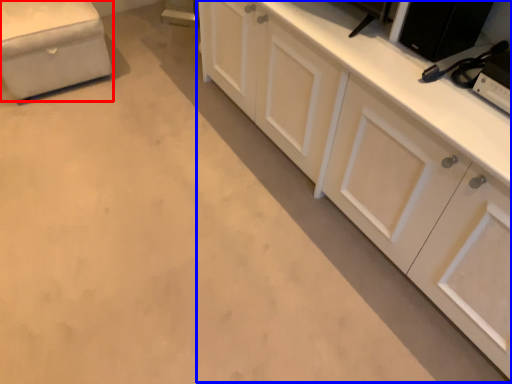
Question: Which point is further to the camera, furniture (highlighted by a red box) or cabinetry (highlighted by a blue box)?

Choices:
 (A) furniture
 (B) cabinetry

Answer: (A)